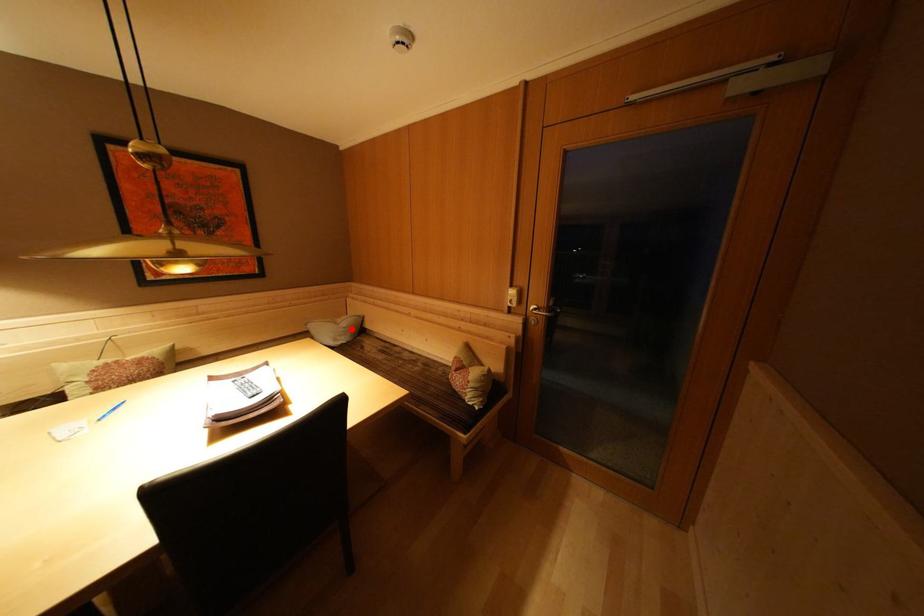
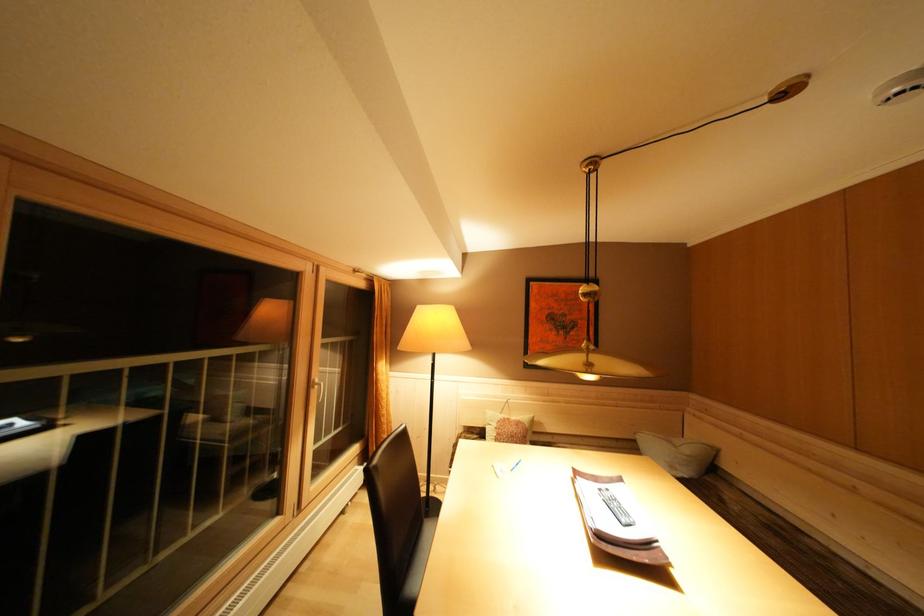
The point at the highlighted location is marked in the first image. Where is the corresponding point in the second image?

(695, 456)